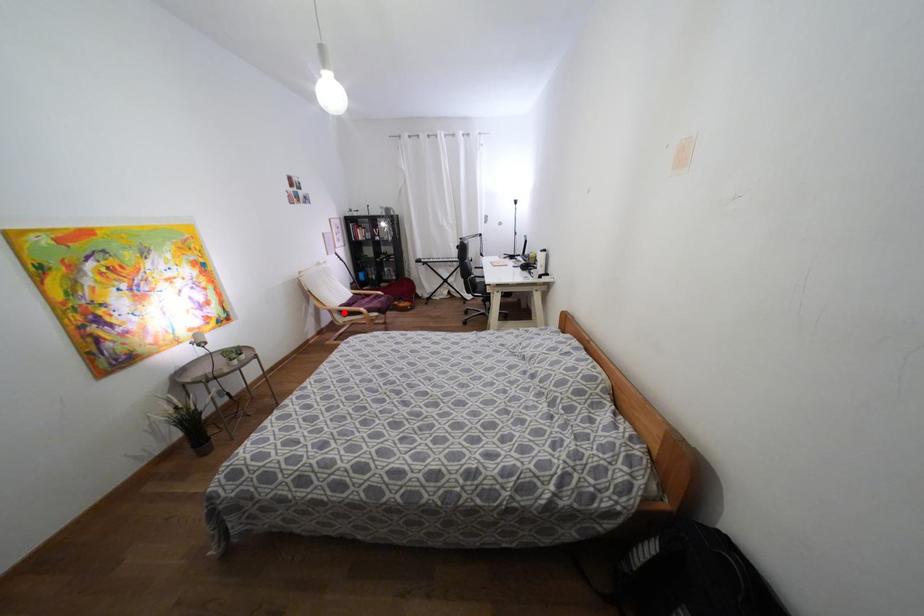
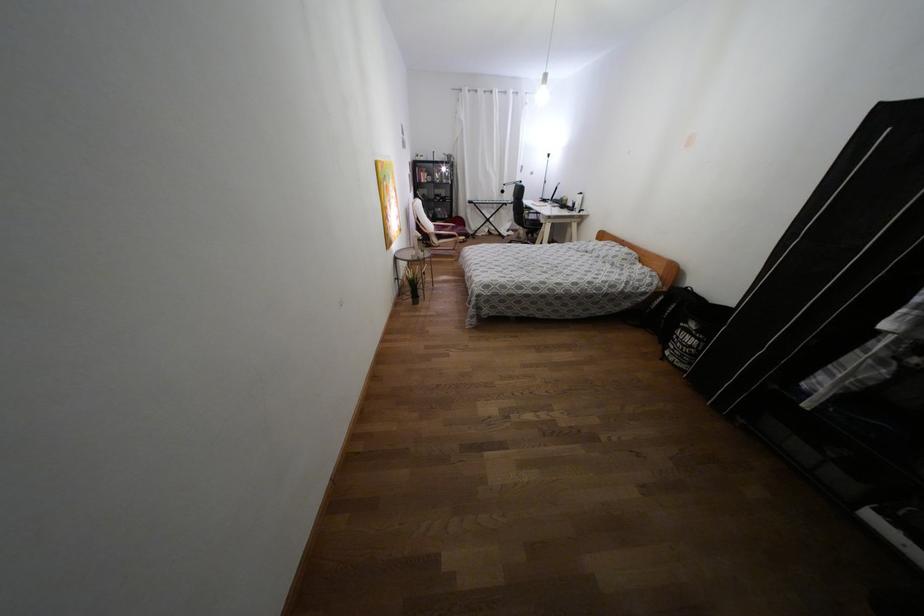
Where in the second image is the point corresponding to the highlighted location from the first image?

(439, 237)